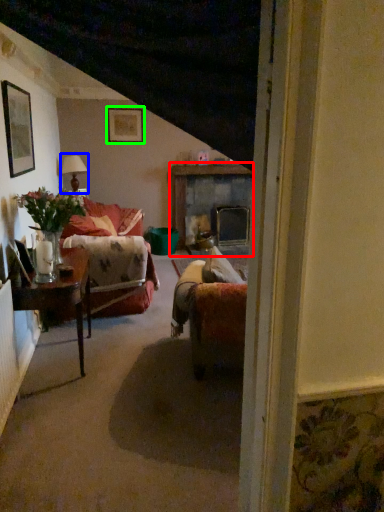
Question: Which object is positioned farthest from fireplace (highlighted by a red box)? Select from lamp (highlighted by a blue box) and picture frame (highlighted by a green box).

Choices:
 (A) lamp
 (B) picture frame

Answer: (A)